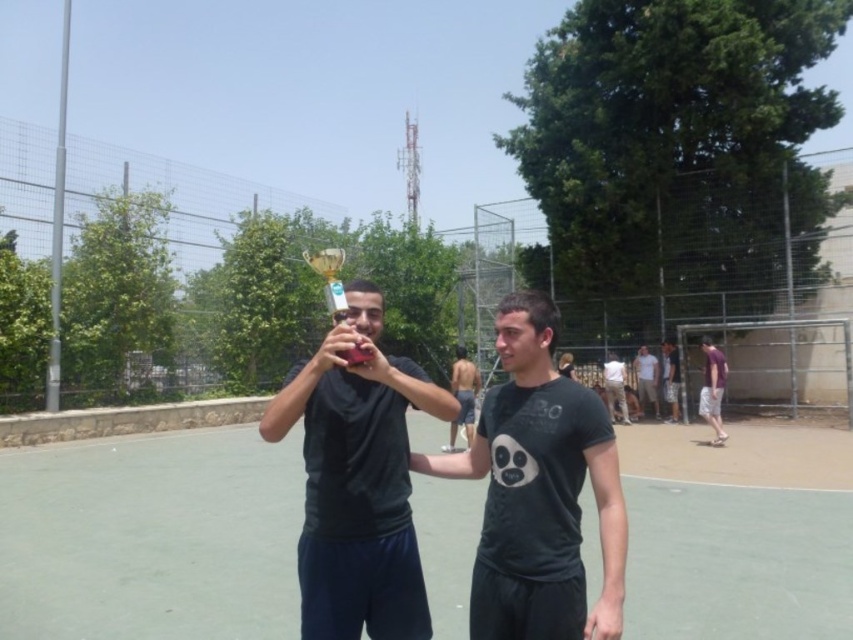
You are a photographer taking a picture of the two men at the sports court. You notice the white cotton shirt at center and the matte pink phone at center. Which object should you focus on first to ensure it appears sharp in the photo?

The white cotton shirt at center is below the matte pink phone at center, so focusing on the matte pink phone at center first will ensure it stays sharp since it is higher in the frame.

You are a photographer at the sports court scene. You need to capture a photo of both the white cotton shirt at center and the matte pink phone at center. Which object should you focus on first if you want to ensure both are in frame without moving the camera?

The white cotton shirt at center is bigger than the matte pink phone at center, so you should focus on the white cotton shirt at center first to ensure both objects fit within the frame.